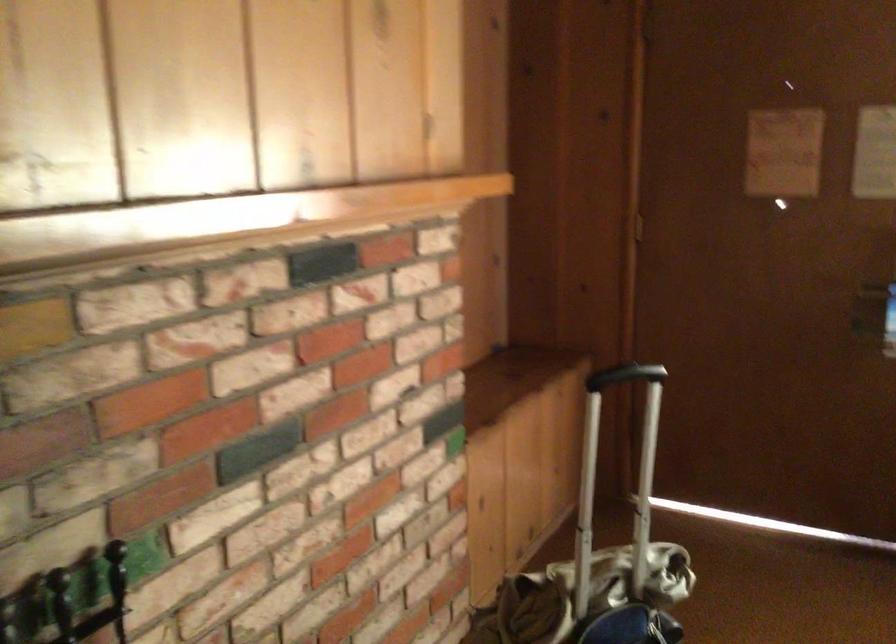
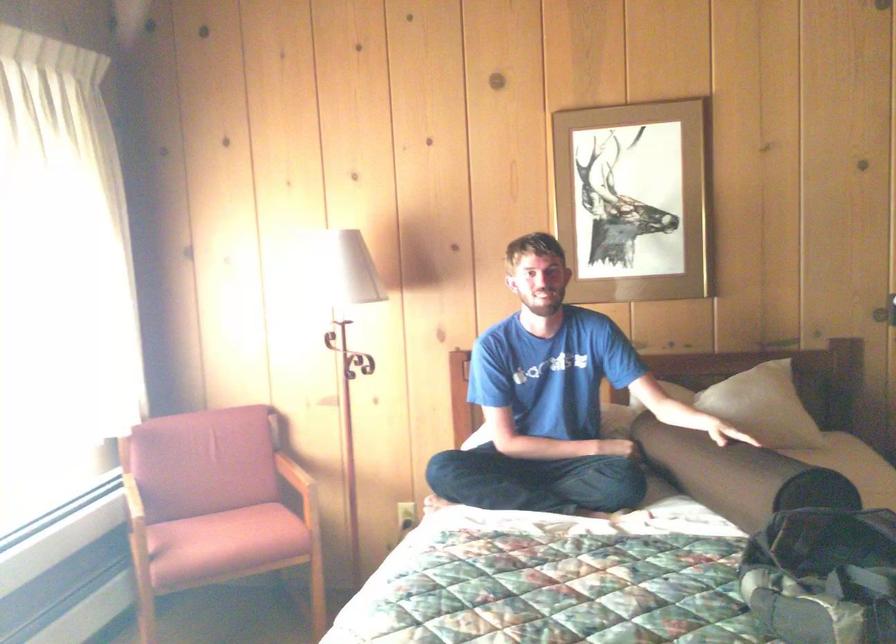
Question: The first image is from the beginning of the video and the second image is from the end. How did the camera likely rotate when shooting the video?

Choices:
 (A) Left
 (B) Right
 (C) Up
 (D) Down

Answer: (B)